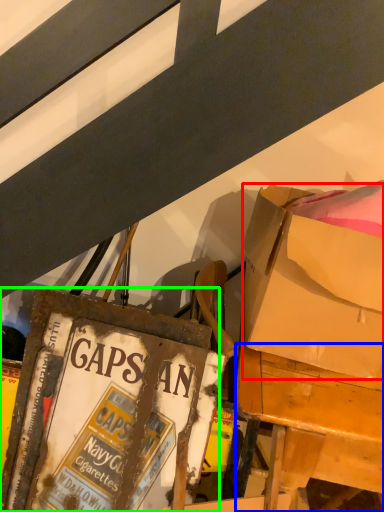
Question: Which is nearer to the box (highlighted by a red box)? desk (highlighted by a blue box) or paperback book (highlighted by a green box).

Choices:
 (A) desk
 (B) paperback book

Answer: (A)